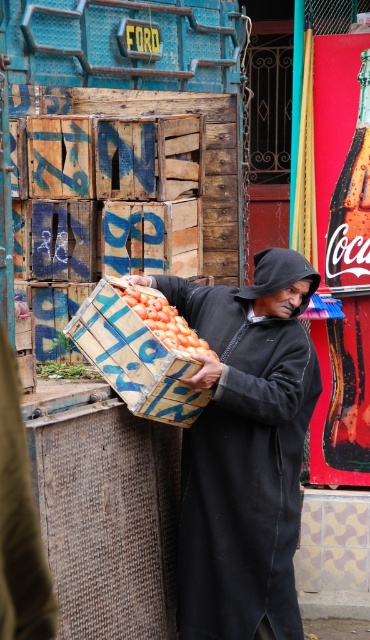
You are standing at the origin point in the image. The black matte robe at center is represented by point (246, 452). Is the black matte robe at center closer to the top or bottom of the image?

The black matte robe at center is represented by point (246, 452). Since the y coordinate is 0.665, which is closer to 1.0, the bottom of the image, the black matte robe at center is closer to the bottom of the image.

You are a delivery person who needs to place a package that is 24 inches long between the black matte robe at center and the smooth orange tomatoes at center. Is there enough space between them to fit the package?

The distance between the black matte robe at center and the smooth orange tomatoes at center is 25.07 inches. Since the package is 24 inches long, there is enough space to fit it between them.

You are a photographer standing in the street scene. You want to take a photo that includes both the man carrying the crate and the Ford truck. The man is at point (210, 500) and the truck is at point (143, 298). Which point is closer to your camera so you can focus on it first?

Point (143, 298) is closer to the camera than point (210, 500). Therefore, you should focus on the truck first before the man carrying the crate.